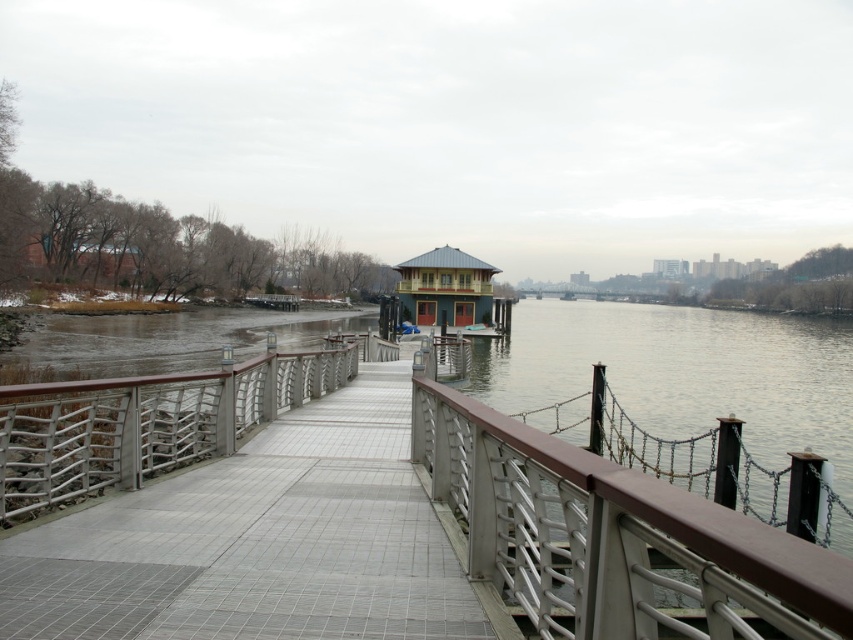
Question: Which object is positioned farthest from the silver metallic railing at center?

Choices:
 (A) brown metallic railing at right
 (B) metallic silver dock at center
 (C) teal matte gazebo at center

Answer: (C)

Question: Which of the following is the farthest from the observer?

Choices:
 (A) brown metallic railing at right
 (B) teal matte gazebo at center

Answer: (B)

Question: Does metallic silver dock at center have a lesser width compared to silver metallic railing at center?

Choices:
 (A) no
 (B) yes

Answer: (B)

Question: Does brown metallic railing at right appear on the left side of teal matte gazebo at center?

Choices:
 (A) yes
 (B) no

Answer: (A)

Question: Which point appears closest to the camera in this image?

Choices:
 (A) (680, 552)
 (B) (474, 268)
 (C) (259, 380)

Answer: (A)

Question: Is brown metallic railing at right positioned before teal matte gazebo at center?

Choices:
 (A) yes
 (B) no

Answer: (A)